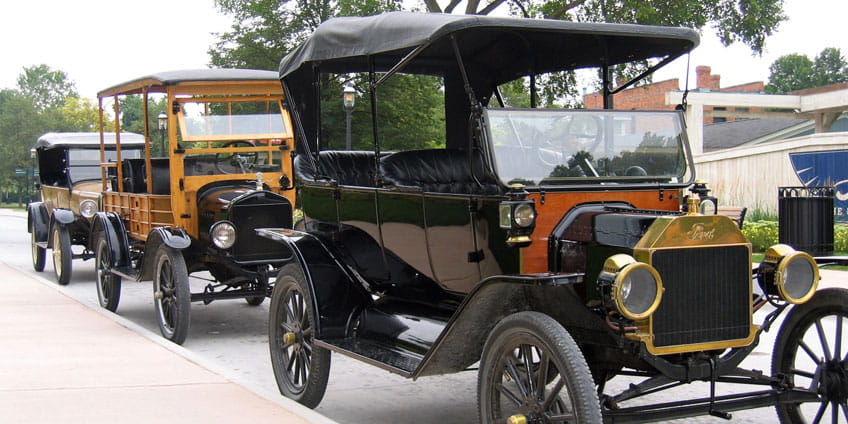
The height and width of the screenshot is (424, 848). Identify the location of light. (644, 283).